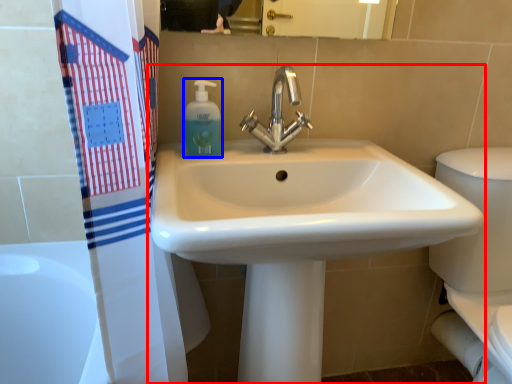
Question: Which point is further to the camera, sink (highlighted by a red box) or soap dispenser (highlighted by a blue box)?

Choices:
 (A) sink
 (B) soap dispenser

Answer: (B)